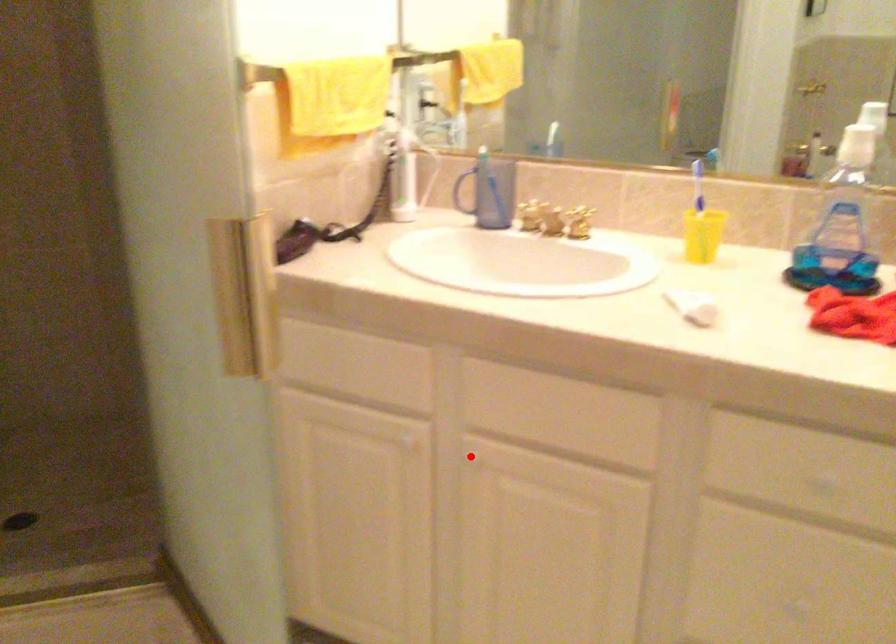
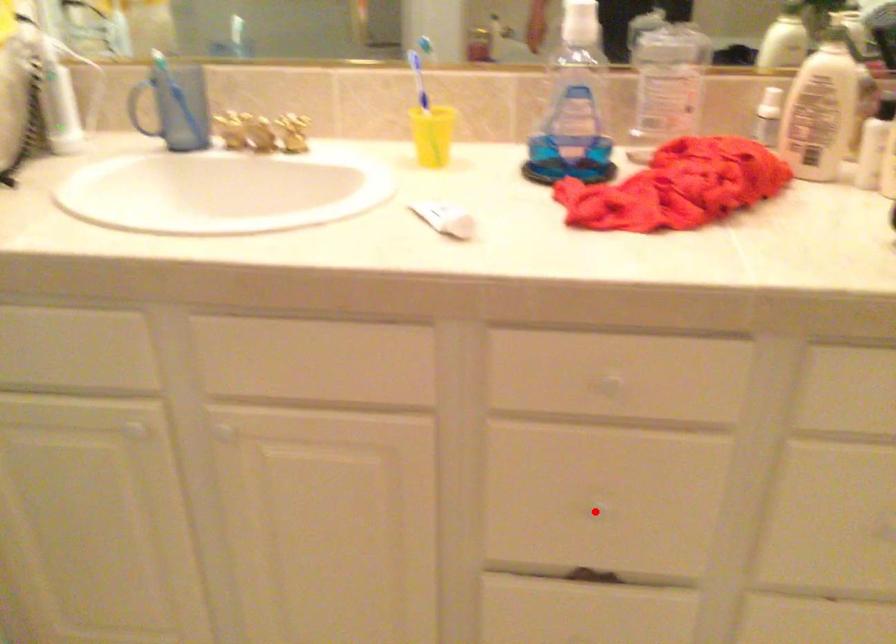
I am providing you with two images of the same scene from different viewpoints. A red point is marked on the first image and another point is marked on the second image. Does the point marked in image1 correspond to the same location as the one in image2?

No